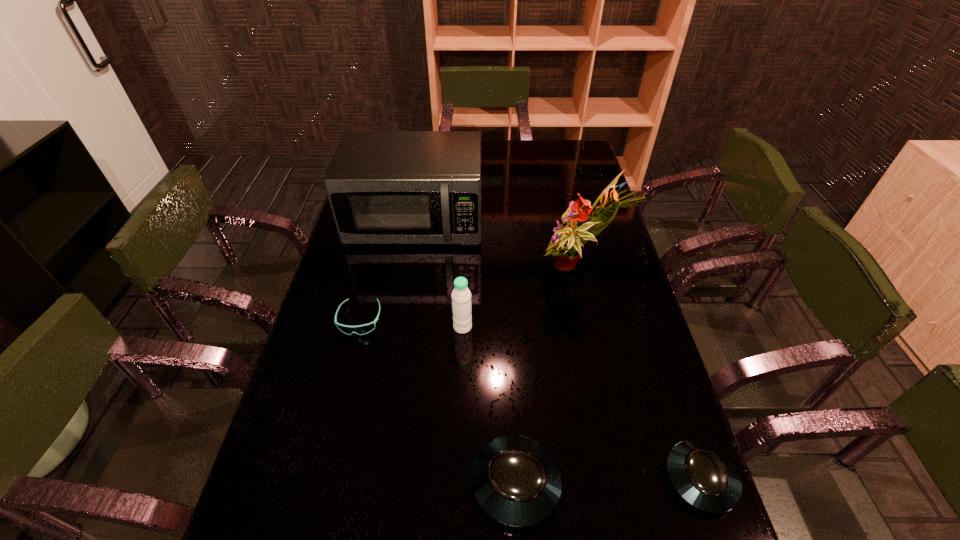
You are a GUI agent. You are given a task and a screenshot of the screen. Output one action in this format:
    pyautogui.click(x=<x>, y=<y>)
    Task: Click on the object that is at the near right corner
    This screenshot has width=960, height=540.
    Given the screenshot: What is the action you would take?
    pyautogui.click(x=701, y=474)

You are a GUI agent. You are given a task and a screenshot of the screen. Output one action in this format:
    pyautogui.click(x=<x>, y=<y>)
    Task: Click on the free spot at the far edge of the desktop
    Image resolution: width=960 pixels, height=540 pixels.
    Given the screenshot: What is the action you would take?
    pyautogui.click(x=547, y=149)

The width and height of the screenshot is (960, 540). Find the location of `vacant space at the left edge`. vacant space at the left edge is located at coordinates (376, 254).

The width and height of the screenshot is (960, 540). I want to click on free space at the right edge of the desktop, so click(x=567, y=190).

Locate an element on the screen. This screenshot has width=960, height=540. free space at the near left corner of the desktop is located at coordinates 261,490.

At what (x,y) coordinates should I click in order to perform the action: click on free space at the far right corner. Please return your answer as a coordinate pair (x, y). Looking at the image, I should click on (564, 147).

Locate an element on the screen. The height and width of the screenshot is (540, 960). free space that is in between the shorter saucer and the tallest object is located at coordinates (638, 375).

Find the location of `unoccupied position between the shortest object and the fourth shortest object`. unoccupied position between the shortest object and the fourth shortest object is located at coordinates (411, 323).

Where is `free spot between the water bottle and the right saucer`? free spot between the water bottle and the right saucer is located at coordinates (582, 403).

The image size is (960, 540). What are the coordinates of `vacant point located between the right saucer and the tallest object` in the screenshot? It's located at (638, 375).